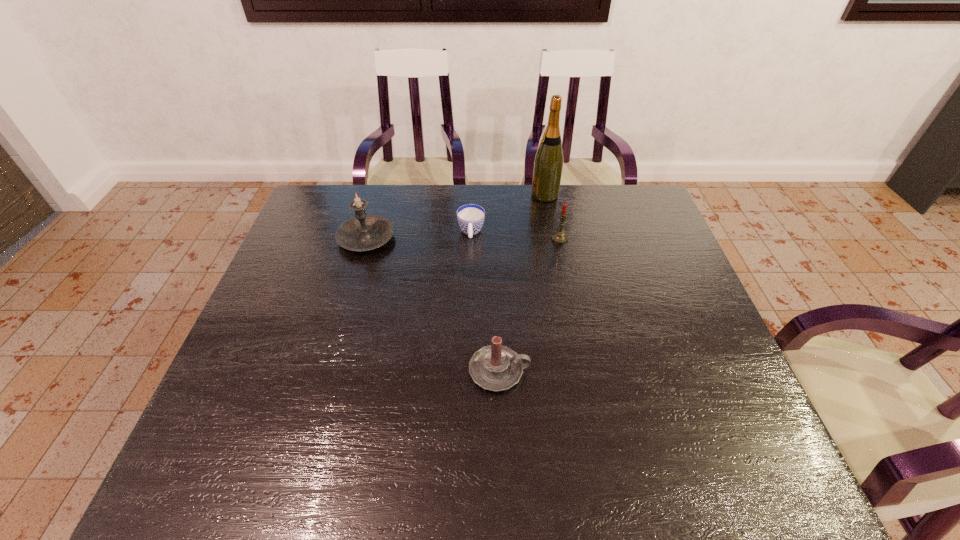
Locate an element on the screen. Image resolution: width=960 pixels, height=540 pixels. wine bottle is located at coordinates (548, 164).

Locate an element on the screen. the tallest object is located at coordinates (548, 164).

Locate an element on the screen. the leftmost candle is located at coordinates (363, 232).

Find the location of a particular element. This screenshot has height=540, width=960. the second tallest object is located at coordinates (363, 232).

At what (x,y) coordinates should I click in order to perform the action: click on the rightmost candle. Please return your answer as a coordinate pair (x, y). The image size is (960, 540). Looking at the image, I should click on (559, 237).

This screenshot has width=960, height=540. Find the location of `the second candle from left to right`. the second candle from left to right is located at coordinates (496, 368).

Identify the location of the nearest candle. (496, 368).

Identify the location of the shortest object. The height and width of the screenshot is (540, 960). (470, 217).

The width and height of the screenshot is (960, 540). Find the location of `vacant space situated on the front-facing side of the wine bottle`. vacant space situated on the front-facing side of the wine bottle is located at coordinates (495, 195).

You are a GUI agent. You are given a task and a screenshot of the screen. Output one action in this format:
    pyautogui.click(x=<x>, y=<y>)
    Task: Click on the free space located 0.290m on the front-facing side of the wine bottle
    The image size is (960, 540).
    Given the screenshot: What is the action you would take?
    (445, 195)